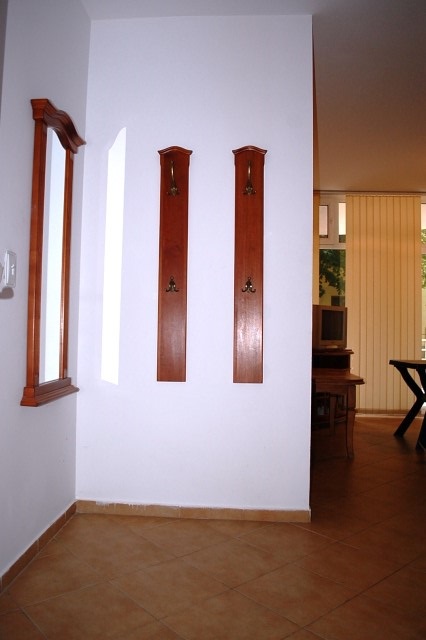
Locate an element on the screen. This screenshot has width=426, height=640. computer screen is located at coordinates (325, 326).